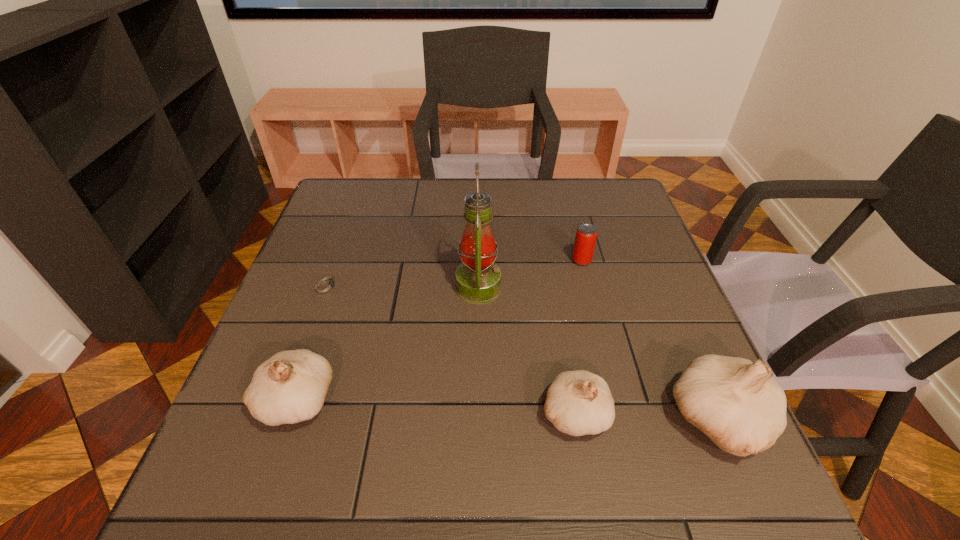
This screenshot has height=540, width=960. Find the location of `vacant spot for a new garlic to ensure equal spacing`. vacant spot for a new garlic to ensure equal spacing is located at coordinates (434, 407).